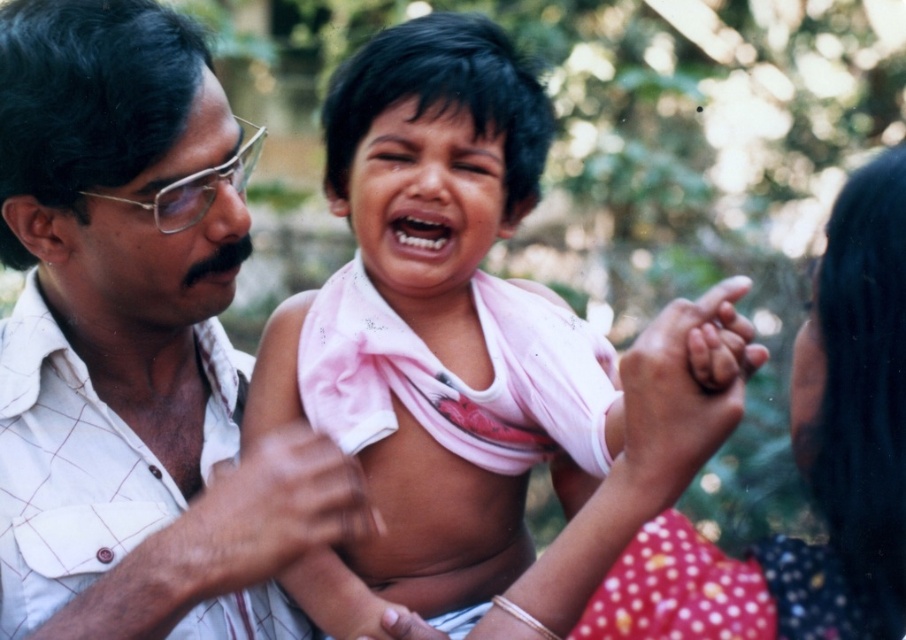
Question: Which object is positioned closest to the white checkered shirt at left?

Choices:
 (A) pink fabric cloth at center
 (B) pink cotton shirt at center

Answer: (A)

Question: Which of the following is the farthest from the observer?

Choices:
 (A) pink fabric cloth at center
 (B) white checkered shirt at left

Answer: (A)

Question: Can you confirm if pink fabric cloth at center is positioned below pink cotton shirt at center?

Choices:
 (A) no
 (B) yes

Answer: (A)

Question: Does white checkered shirt at left have a lesser width compared to pink cotton shirt at center?

Choices:
 (A) yes
 (B) no

Answer: (B)

Question: From the image, what is the correct spatial relationship of white checkered shirt at left in relation to pink fabric cloth at center?

Choices:
 (A) above
 (B) below

Answer: (B)

Question: Which point is closer to the camera?

Choices:
 (A) pink fabric cloth at center
 (B) white checkered shirt at left

Answer: (B)